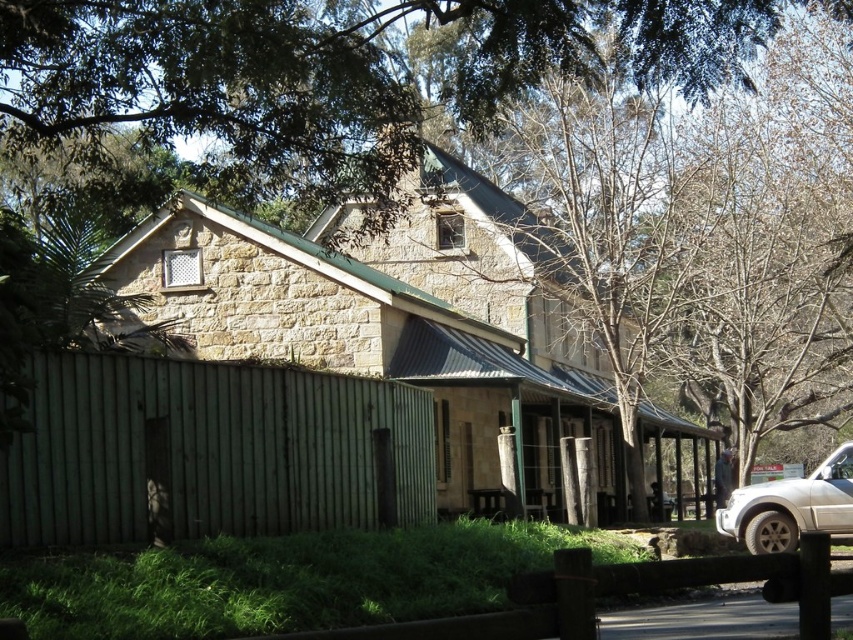
Can you confirm if green wooden fence at lower left is positioned above white matte suv at lower right?

Yes.

Is green wooden fence at lower left below white matte suv at lower right?

Actually, green wooden fence at lower left is above white matte suv at lower right.

This screenshot has height=640, width=853. Identify the location of green wooden fence at lower left. (207, 451).

Identify the location of green wooden fence at lower left. The height and width of the screenshot is (640, 853). (207, 451).

Is stone church at center to the left of white matte suv at lower right from the viewer's perspective?

Yes, stone church at center is to the left of white matte suv at lower right.

Is point (426, 352) more distant than point (776, 540)?

Yes, it is.

Who is more forward, (410, 310) or (769, 518)?

Point (769, 518)

At what (x,y) coordinates should I click in order to perform the action: click on stone church at center. Please return your answer as a coordinate pair (x, y). The height and width of the screenshot is (640, 853). Looking at the image, I should click on (395, 324).

Is point (606, 433) positioned behind point (3, 452)?

Yes, point (606, 433) is behind point (3, 452).

Does stone church at center appear under green wooden fence at lower left?

Correct, stone church at center is located below green wooden fence at lower left.

Is point (172, 248) positioned after point (207, 420)?

Yes, it is behind point (207, 420).

Identify the location of stone church at center. (395, 324).